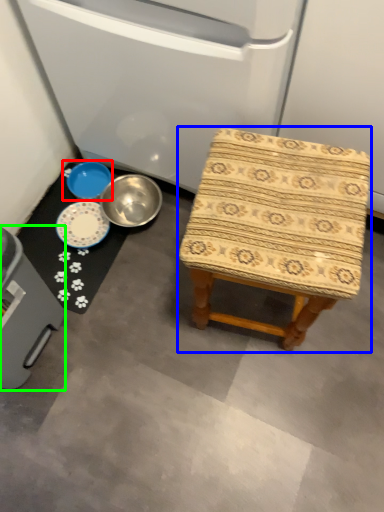
Question: Considering the real-world distances, which object is farthest from basin (highlighted by a red box)? stool (highlighted by a blue box) or appliance (highlighted by a green box)?

Choices:
 (A) stool
 (B) appliance

Answer: (A)